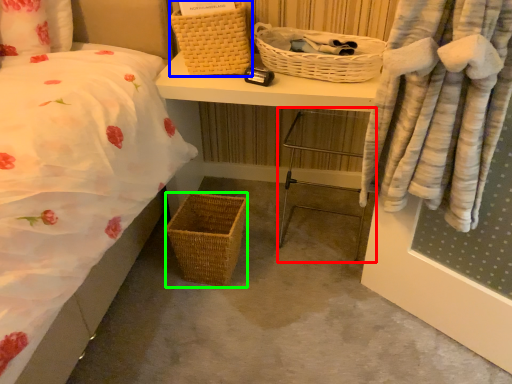
Question: Based on their relative distances, which object is nearer to chair (highlighted by a red box)? Choose from picnic basket (highlighted by a blue box) and picnic basket (highlighted by a green box).

Choices:
 (A) picnic basket
 (B) picnic basket

Answer: (B)